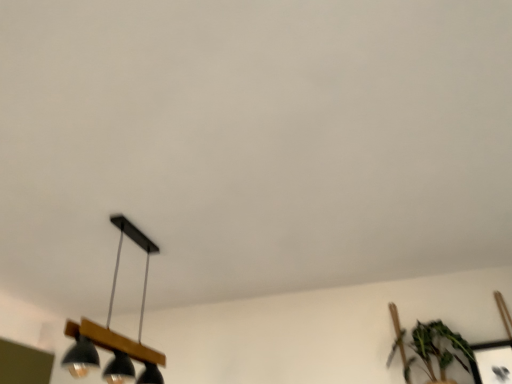
Question: Looking at their shapes, would you say metallic silver picture frame at lower right is wider or thinner than green leafy plant at lower right?

Choices:
 (A) thin
 (B) wide

Answer: (A)

Question: In the image, is metallic silver picture frame at lower right on the left side or the right side of green leafy plant at lower right?

Choices:
 (A) right
 (B) left

Answer: (A)

Question: Based on their relative distances, which object is farther from the black matte/wooden lamp at lower left?

Choices:
 (A) metallic silver picture frame at lower right
 (B) green leafy plant at lower right

Answer: (A)

Question: Based on their relative distances, which object is nearer to the black matte/wooden lamp at lower left?

Choices:
 (A) metallic silver picture frame at lower right
 (B) green leafy plant at lower right

Answer: (B)